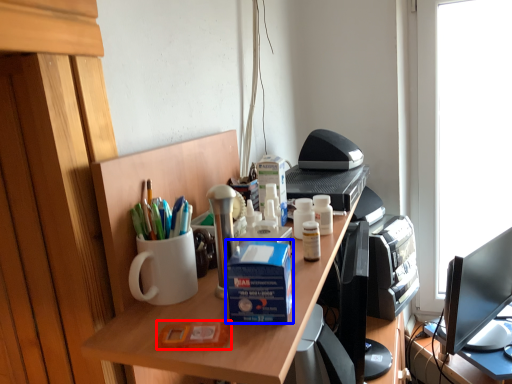
Question: Which of the following is the farthest to the observer, stationery (highlighted by a red box) or box (highlighted by a blue box)?

Choices:
 (A) stationery
 (B) box

Answer: (B)